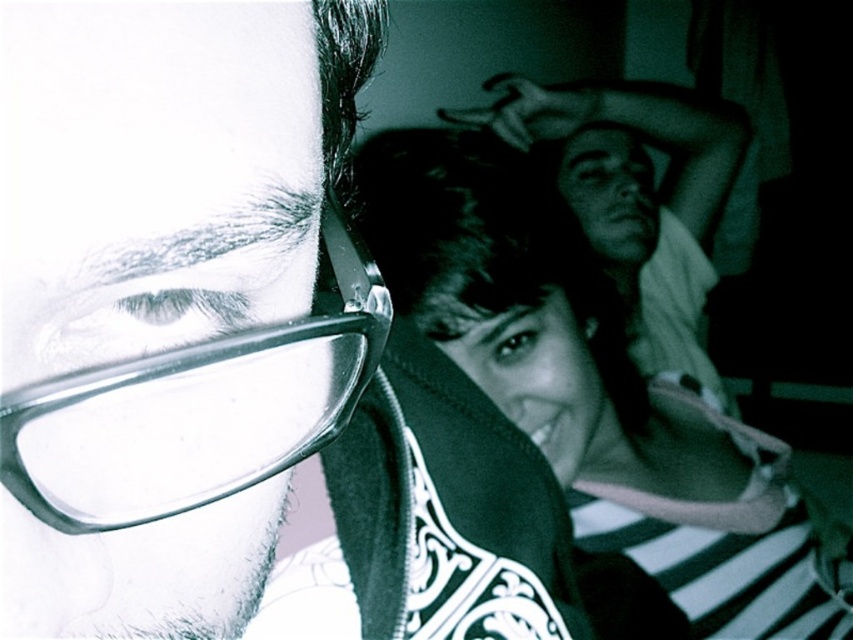
Consider the image. You are a photographer setting up a photo shoot. You have two pairs of glasses in the scene, the matte black glasses at upper left and the clear plastic glasses at center. Which pair of glasses is closer to the camera?

The matte black glasses at upper left is in front of clear plastic glasses at center, so the matte black glasses at upper left is closer to the camera.

You are a photographer setting up a shoot. You have two pairs of glasses in the scene, the matte black glasses at upper left and the clear plastic glasses at center. From the photographer perspective, which glasses are positioned lower in the frame?

The matte black glasses at upper left is located below the clear plastic glasses at center, so the matte black glasses at upper left are positioned lower in the frame.

In the scene shown: You are a photographer adjusting the focus on your camera. You need to ensure that both points, point (x=140, y=150) and point (x=151, y=456), are in focus. Given that your current focus plane can only be set at one depth, which point should you focus on to maximize the chances of both being sharp?

You should focus on point (x=140, y=150) because it is closer to the camera than point (x=151, y=456). By focusing on the closer point, the depth of field will extend further back, increasing the likelihood that both points are in acceptable focus.